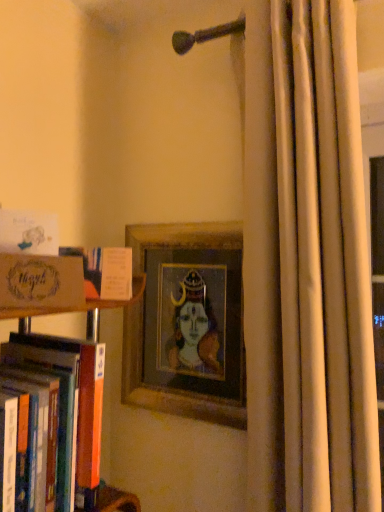
Question: Is beige fabric curtain at right a part of orange cardboard book at left, acting as the second book starting from the bottom?

Choices:
 (A) no
 (B) yes

Answer: (A)

Question: Can you confirm if orange cardboard book at left, acting as the second book starting from the bottom, is thinner than beige fabric curtain at right?

Choices:
 (A) no
 (B) yes

Answer: (B)

Question: Is orange cardboard book at left, which ranks as the second book in top-to-bottom order, looking in the opposite direction of beige fabric curtain at right?

Choices:
 (A) no
 (B) yes

Answer: (A)

Question: Considering the relative positions of orange cardboard book at left, which ranks as the second book in top-to-bottom order, and beige fabric curtain at right in the image provided, is orange cardboard book at left, which ranks as the second book in top-to-bottom order, behind beige fabric curtain at right?

Choices:
 (A) no
 (B) yes

Answer: (B)

Question: From the image's perspective, is orange cardboard book at left, which ranks as the second book in top-to-bottom order, beneath beige fabric curtain at right?

Choices:
 (A) no
 (B) yes

Answer: (B)

Question: Does orange cardboard book at left, acting as the second book starting from the bottom, have a larger size compared to beige fabric curtain at right?

Choices:
 (A) no
 (B) yes

Answer: (A)

Question: Is the position of matte cardboard box at left less distant than that of orange cardboard book at left, acting as the second book starting from the bottom?

Choices:
 (A) no
 (B) yes

Answer: (B)

Question: Is matte cardboard box at left further to camera compared to orange cardboard book at left, which ranks as the second book in top-to-bottom order?

Choices:
 (A) no
 (B) yes

Answer: (A)

Question: Is matte cardboard box at left facing towards orange cardboard book at left, acting as the second book starting from the bottom?

Choices:
 (A) no
 (B) yes

Answer: (A)

Question: From a real-world perspective, is matte cardboard box at left on orange cardboard book at left, acting as the second book starting from the bottom?

Choices:
 (A) no
 (B) yes

Answer: (A)

Question: Can orange cardboard book at left, which ranks as the second book in top-to-bottom order, be found inside matte cardboard box at left?

Choices:
 (A) yes
 (B) no

Answer: (B)

Question: Considering the relative positions of matte cardboard box at left and orange cardboard book at left, which ranks as the second book in top-to-bottom order, in the image provided, is matte cardboard box at left to the right of orange cardboard book at left, which ranks as the second book in top-to-bottom order, from the viewer's perspective?

Choices:
 (A) no
 (B) yes

Answer: (A)

Question: Is matte cardboard box at left oriented towards beige fabric curtain at right?

Choices:
 (A) no
 (B) yes

Answer: (A)